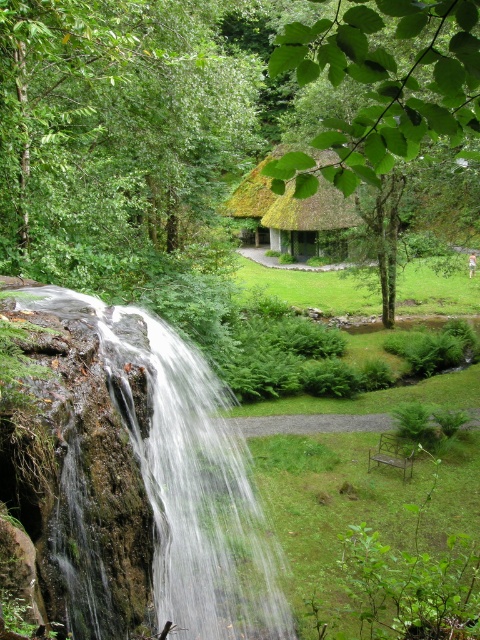
Describe the element at coordinates (118, 131) in the screenshot. Image resolution: width=480 pixels, height=640 pixels. I see `green leafy tree at upper left` at that location.

Is green leafy tree at upper left smaller than green leafy tree at upper center?

Indeed, green leafy tree at upper left has a smaller size compared to green leafy tree at upper center.

You are a GUI agent. You are given a task and a screenshot of the screen. Output one action in this format:
    pyautogui.click(x=<x>, y=<y>)
    Task: Click on the green leafy tree at upper left
    The width and height of the screenshot is (480, 640).
    Given the screenshot: What is the action you would take?
    pyautogui.click(x=118, y=131)

Is green leafy tree at upper center taller than thatched roof hut at center?

Yes, green leafy tree at upper center is taller than thatched roof hut at center.

Can you confirm if green leafy tree at upper center is shorter than thatched roof hut at center?

No, green leafy tree at upper center is not shorter than thatched roof hut at center.

This screenshot has width=480, height=640. Identify the location of green leafy tree at upper center. (380, 88).

Based on the photo, does green leafy tree at upper left appear on the right side of clear water at center?

In fact, green leafy tree at upper left is to the left of clear water at center.

Who is positioned more to the left, green leafy tree at upper left or clear water at center?

From the viewer's perspective, green leafy tree at upper left appears more on the left side.

Where is `green leafy tree at upper left`? The image size is (480, 640). green leafy tree at upper left is located at coordinates (118, 131).